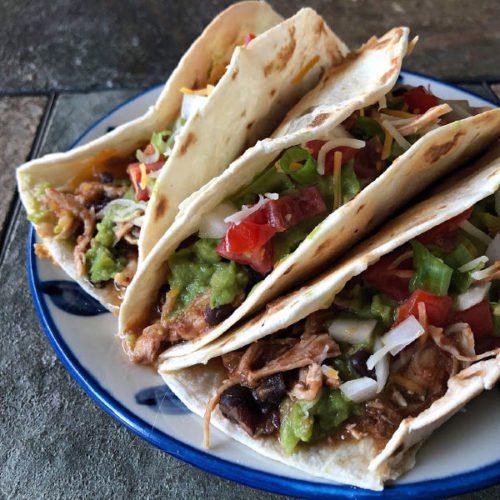
You are a GUI agent. You are given a task and a screenshot of the screen. Output one action in this format:
    pyautogui.click(x=<x>, y=<y>)
    Task: Click on the grey tile upper left corner
    The width and height of the screenshot is (500, 500).
    Given the screenshot: What is the action you would take?
    coord(127,26), coord(36,40)